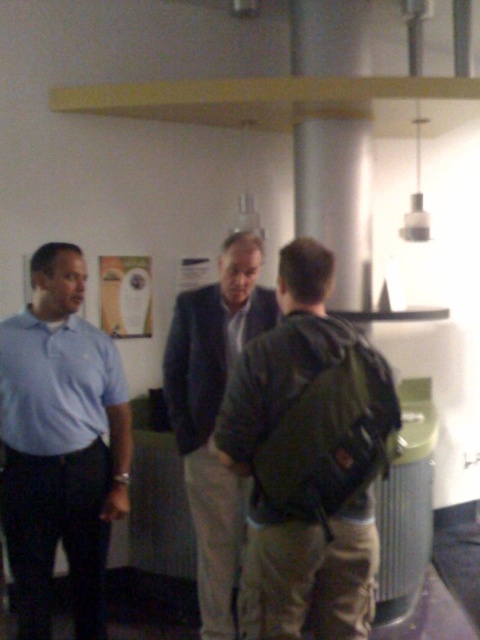
You are standing in the room and need to hand a document to the light blue cotton shirt at left without disturbing the conversation. The document must be placed on the green fabric backpack at center. Is this possible given their positions?

The green fabric backpack at center is located above the light blue cotton shirt at left, so placing the document on the backpack would require reaching upwards. This is feasible without disturbing the conversation as the backpack is positioned above the shirt wearer.

You are a photographer who needs to set up a tripod between the green fabric backpack at center and the camera. The tripod requires a minimum of 1.5 meters of space to function properly. Can you place it there?

The green fabric backpack at center and camera are 1.80 meters apart from each other, which is more than the required 1.5 meters. Therefore, the tripod can be placed between them with sufficient space.